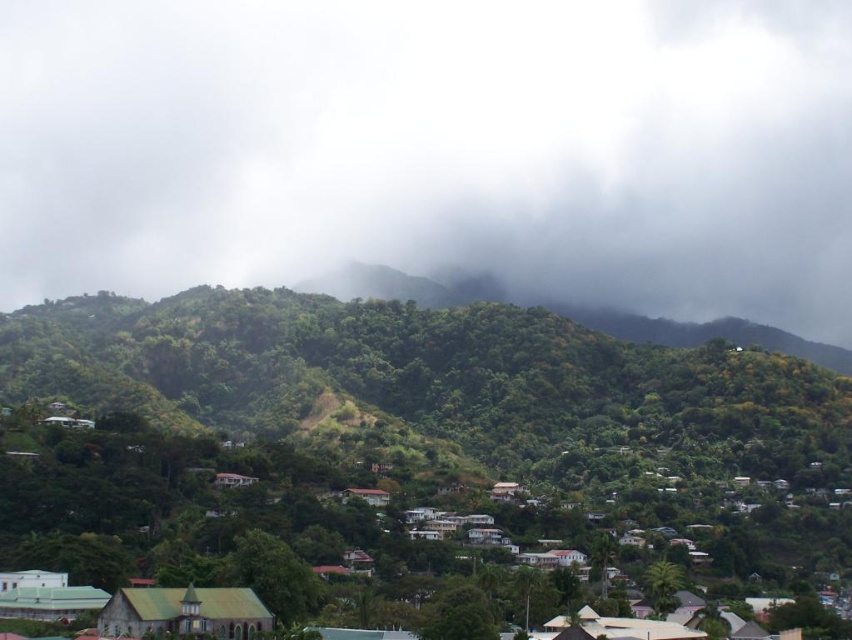
Who is higher up, white fluffy cloud at upper center or green corrugated metal roof at lower left?

white fluffy cloud at upper center is above.

Based on the photo, is white fluffy cloud at upper center taller than green corrugated metal roof at lower left?

Yes.

Which is in front, point (59, 216) or point (226, 602)?

Positioned in front is point (226, 602).

I want to click on white fluffy cloud at upper center, so click(x=435, y=147).

Who is lower down, green leafy forest at center or brown wooden hut at center?

brown wooden hut at center is below.

Looking at this image, is green leafy forest at center above brown wooden hut at center?

Yes.

Locate an element on the screen. The image size is (852, 640). green leafy forest at center is located at coordinates (435, 376).

Is white fluffy cloud at upper center bigger than green leafy forest at center?

Correct, white fluffy cloud at upper center is larger in size than green leafy forest at center.

Is white fluffy cloud at upper center positioned before green leafy forest at center?

No, white fluffy cloud at upper center is further to the viewer.

Between point (688, 0) and point (776, 372), which one is positioned in front?

Point (776, 372) is in front.

Locate an element on the screen. This screenshot has height=640, width=852. white fluffy cloud at upper center is located at coordinates click(x=435, y=147).